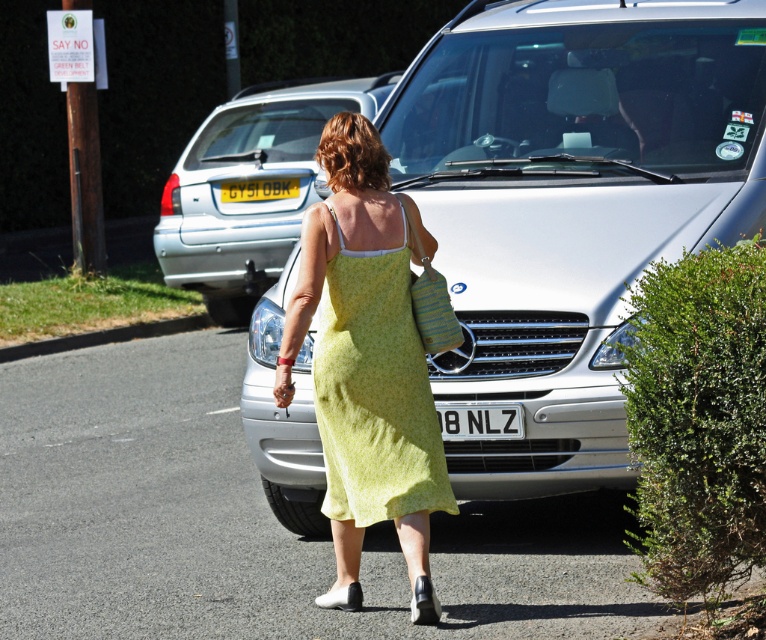
Does white plastic license plate at center appear on the right side of yellow plastic license plate at center?

Correct, you'll find white plastic license plate at center to the right of yellow plastic license plate at center.

Find the location of a particular element. The width and height of the screenshot is (766, 640). white plastic license plate at center is located at coordinates (480, 420).

Who is more forward, (463,412) or (293,195)?

Point (463,412) is more forward.

Where is `white plastic license plate at center`? The height and width of the screenshot is (640, 766). white plastic license plate at center is located at coordinates (480, 420).

Which is more to the left, linen green dress at center or yellow plastic license plate at center?

yellow plastic license plate at center

Is the position of linen green dress at center less distant than that of yellow plastic license plate at center?

Yes, it is.

At what (x,y) coordinates should I click in order to perform the action: click on linen green dress at center. Please return your answer as a coordinate pair (x, y). The image size is (766, 640). Looking at the image, I should click on (375, 390).

Consider the image. Measure the distance between point (580, 397) and camera.

Point (580, 397) and camera are 8.17 meters apart.

This screenshot has height=640, width=766. What are the coordinates of `silver metallic car at center` in the screenshot? It's located at (570, 204).